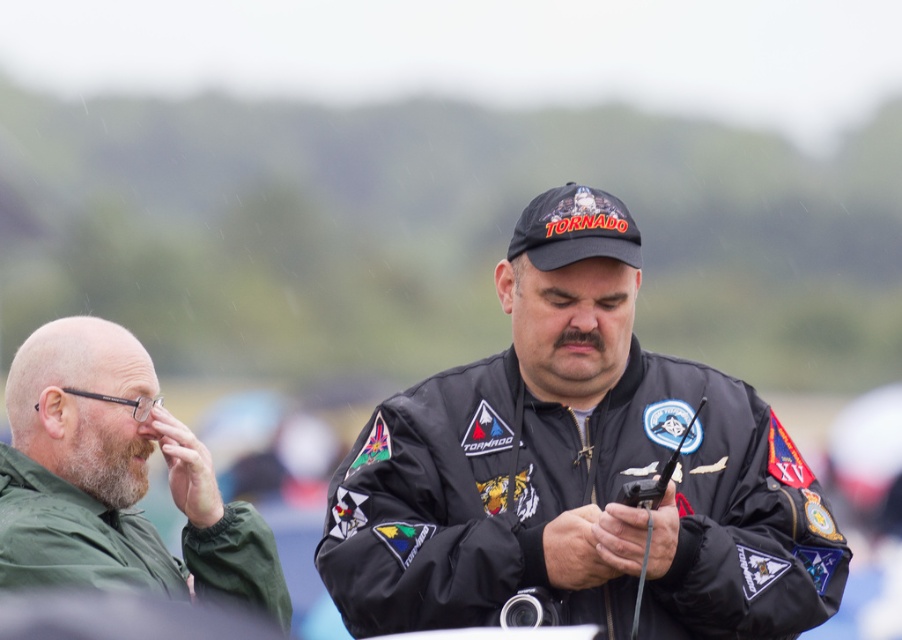
Can you confirm if black matte jacket at center is positioned above green matte jacket at left?

Yes, black matte jacket at center is above green matte jacket at left.

You are a GUI agent. You are given a task and a screenshot of the screen. Output one action in this format:
    pyautogui.click(x=<x>, y=<y>)
    Task: Click on the black matte jacket at center
    This screenshot has height=640, width=902.
    Given the screenshot: What is the action you would take?
    pyautogui.click(x=577, y=468)